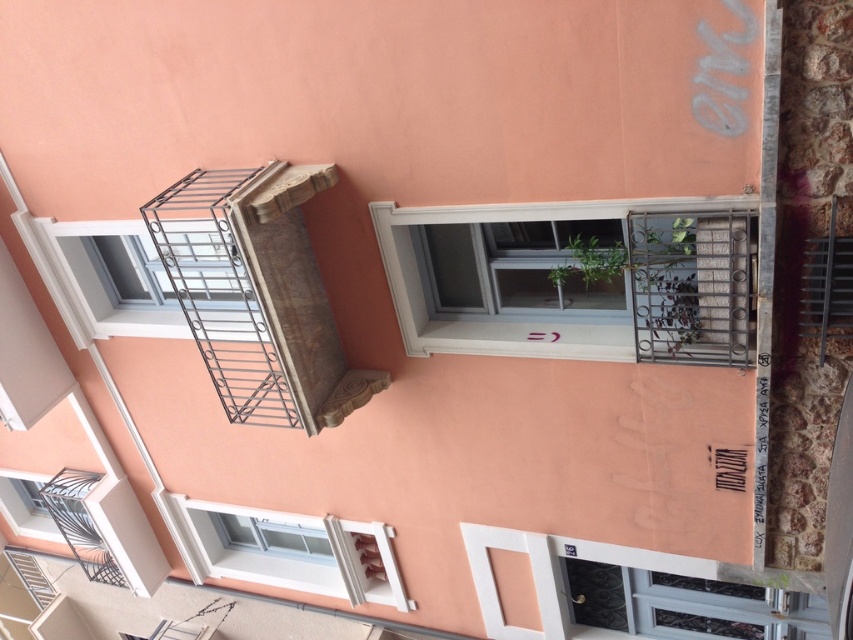
Between point (276, 524) and point (9, 502), which one is positioned in front?

Point (276, 524)

Who is more forward, (299, 577) or (28, 486)?

Positioned in front is point (299, 577).

At what (x,y) coordinates should I click in order to perform the action: click on white glossy window at lower left. Please return your answer as a coordinate pair (x, y). Looking at the image, I should click on (293, 550).

Can you confirm if white plastic window at center is taller than metallic silver balcony at upper left?

Yes.

Who is positioned more to the left, white plastic window at center or metallic silver balcony at upper left?

metallic silver balcony at upper left is more to the left.

Which is in front, point (572, 355) or point (93, 289)?

Point (572, 355) is in front.

Where is `white plastic window at center`? This screenshot has height=640, width=853. white plastic window at center is located at coordinates (514, 275).

Is metallic gray fire escape at upper left to the right of metallic silver balcony at upper left from the viewer's perspective?

Yes, metallic gray fire escape at upper left is to the right of metallic silver balcony at upper left.

Is metallic gray fire escape at upper left to the left of metallic silver balcony at upper left from the viewer's perspective?

In fact, metallic gray fire escape at upper left is to the right of metallic silver balcony at upper left.

Who is more forward, (300,268) or (68,288)?

Point (300,268)

Identify the location of metallic gray fire escape at upper left. The width and height of the screenshot is (853, 640). (257, 292).